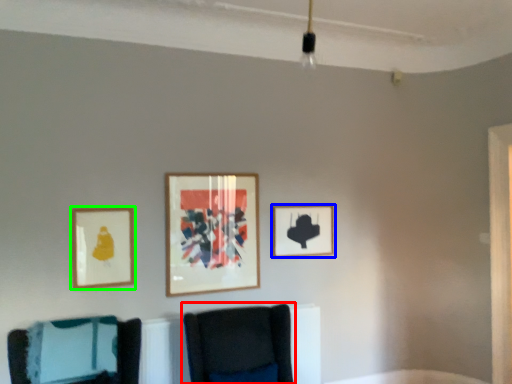
Question: Considering the real-world distances, which object is farthest from furniture (highlighted by a red box)? picture frame (highlighted by a blue box) or picture frame (highlighted by a green box)?

Choices:
 (A) picture frame
 (B) picture frame

Answer: (B)